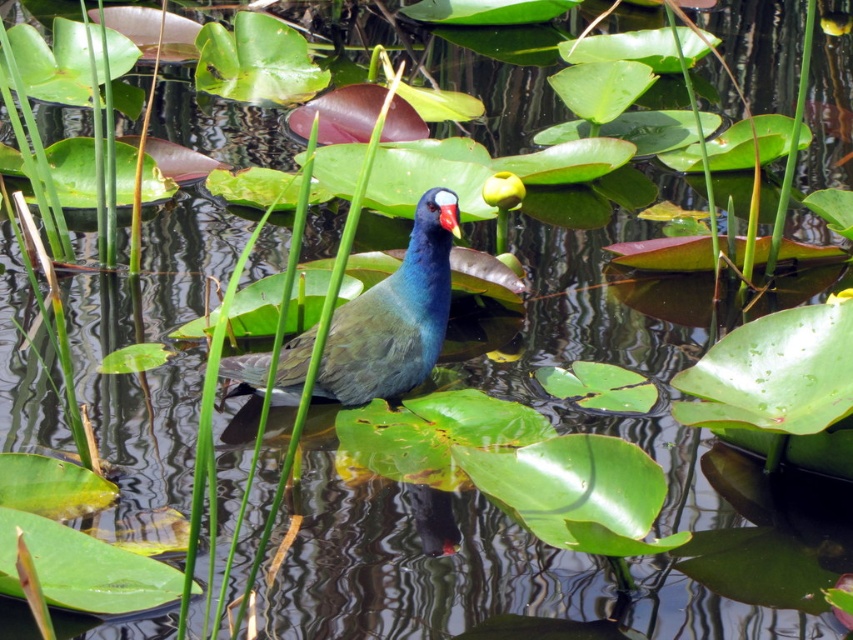
Question: Which object is farther from the camera taking this photo?

Choices:
 (A) purple glossy bird at center
 (B) purple glossy beak at center

Answer: (A)

Question: Is purple glossy bird at center positioned at the back of purple glossy beak at center?

Choices:
 (A) no
 (B) yes

Answer: (B)

Question: Which object appears farthest from the camera in this image?

Choices:
 (A) purple glossy bird at center
 (B) purple glossy beak at center

Answer: (A)

Question: From the image, what is the correct spatial relationship of purple glossy bird at center in relation to purple glossy beak at center?

Choices:
 (A) above
 (B) below

Answer: (B)

Question: Which point is closer to the camera?

Choices:
 (A) purple glossy bird at center
 (B) purple glossy beak at center

Answer: (B)

Question: Can you confirm if purple glossy bird at center is wider than purple glossy beak at center?

Choices:
 (A) yes
 (B) no

Answer: (A)